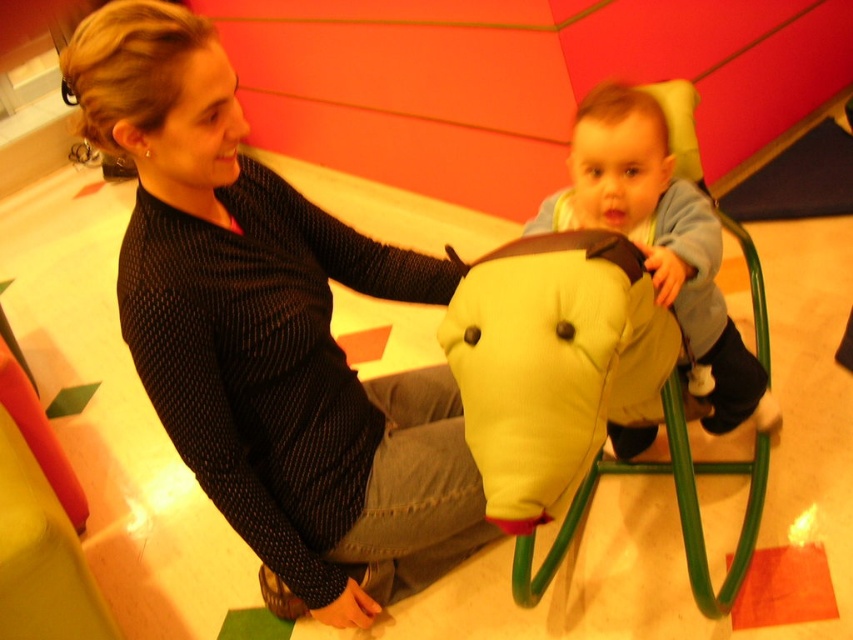
Is black dotted sweater at upper left to the right of soft yellow fabric elephant at center from the viewer's perspective?

Incorrect, black dotted sweater at upper left is not on the right side of soft yellow fabric elephant at center.

Between black dotted sweater at upper left and soft yellow fabric elephant at center, which one appears on the left side from the viewer's perspective?

black dotted sweater at upper left is more to the left.

Is point (329, 516) behind point (532, 509)?

Yes, point (329, 516) is farther from viewer.

Find the location of a particular element. This screenshot has height=640, width=853. black dotted sweater at upper left is located at coordinates (270, 333).

Who is shorter, black dotted sweater at upper left or soft yellow plush at center?

soft yellow plush at center is shorter.

Does black dotted sweater at upper left have a greater width compared to soft yellow plush at center?

Indeed, black dotted sweater at upper left has a greater width compared to soft yellow plush at center.

Between point (270, 556) and point (625, 145), which one is positioned behind?

The point (625, 145) is more distant.

Where is `black dotted sweater at upper left`? This screenshot has height=640, width=853. black dotted sweater at upper left is located at coordinates (270, 333).

Can you confirm if soft yellow fabric elephant at center is positioned above soft yellow plush at center?

No, soft yellow fabric elephant at center is not above soft yellow plush at center.

Who is more forward, [601,232] or [692,378]?

Point [601,232]

You are a GUI agent. You are given a task and a screenshot of the screen. Output one action in this format:
    pyautogui.click(x=<x>, y=<y>)
    Task: Click on the soft yellow fabric elephant at center
    This screenshot has height=640, width=853.
    Given the screenshot: What is the action you would take?
    tap(552, 364)